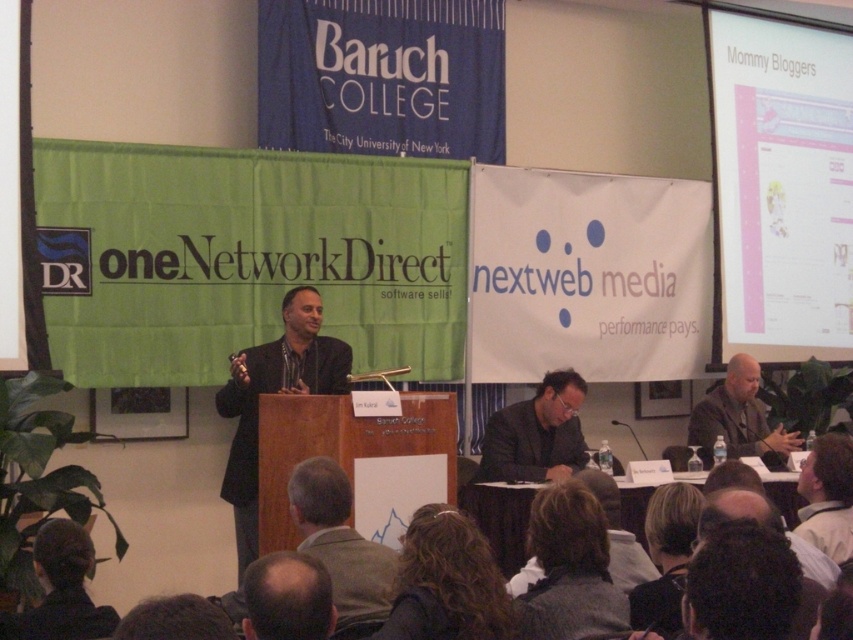
Question: Which point is farther to the camera?

Choices:
 (A) (286, 616)
 (B) (386, 564)

Answer: (B)

Question: Is dark brown hair at lower left below white fabric shirt at lower right?

Choices:
 (A) no
 (B) yes

Answer: (B)

Question: Which of the following is the closest to the observer?

Choices:
 (A) (410, 608)
 (B) (566, 442)

Answer: (A)

Question: Which of these objects is positioned farthest from the dark gray suit at center?

Choices:
 (A) dark brown hair at lower left
 (B) white fabric shirt at lower right
 (C) dark curly hair at lower center

Answer: (A)

Question: Does dark curly hair at lower center have a larger size compared to white fabric shirt at lower right?

Choices:
 (A) yes
 (B) no

Answer: (B)

Question: Observing the image, what is the correct spatial positioning of dark gray hair at lower center in reference to dark curly hair at lower center?

Choices:
 (A) below
 (B) above

Answer: (A)